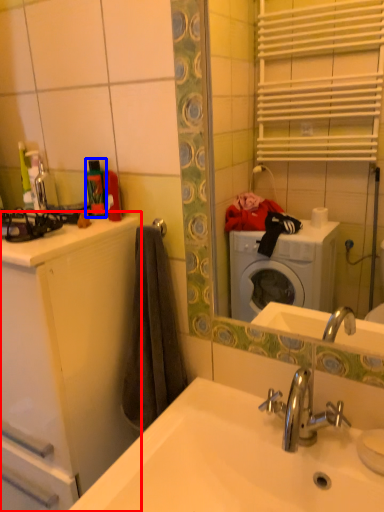
Question: Which point is further to the camera, bathroom cabinet (highlighted by a red box) or toiletry (highlighted by a blue box)?

Choices:
 (A) bathroom cabinet
 (B) toiletry

Answer: (B)